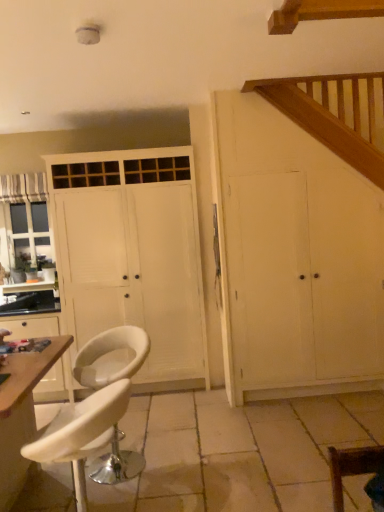
Where is `vacant area that lies between white leather bar stool at lower left, which appears as the first chair when viewed from the left, and white wood cupboard at right, the 1th cupboard viewed from the right`? The width and height of the screenshot is (384, 512). vacant area that lies between white leather bar stool at lower left, which appears as the first chair when viewed from the left, and white wood cupboard at right, the 1th cupboard viewed from the right is located at coordinates (233, 426).